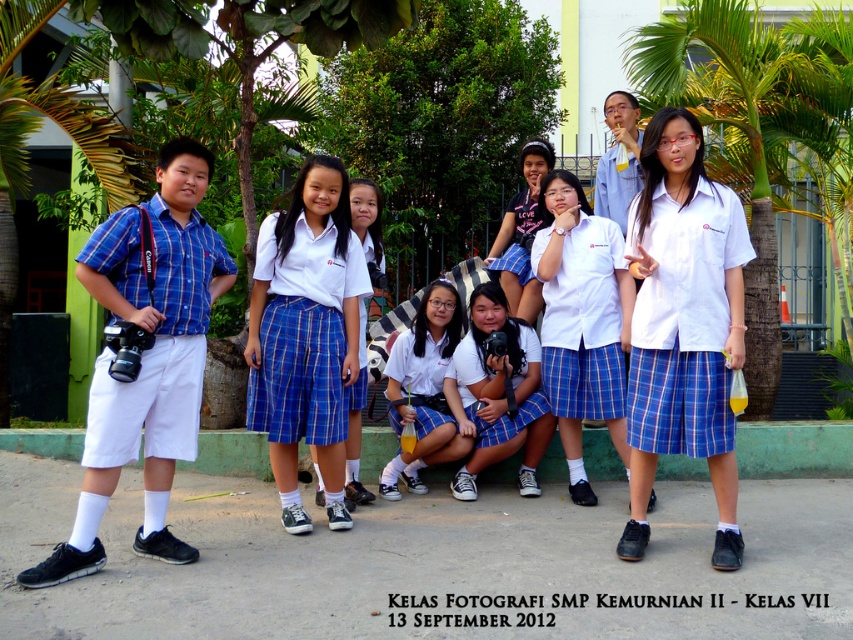
Question: Which object is the closest to the white matte uniform at center?

Choices:
 (A) white plaid skirt at center
 (B) matte black shirt at center
 (C) white glossy skirt at center
 (D) blue plaid skirt at center

Answer: (B)

Question: Where is white plaid skirt at center located in relation to white glossy skirt at center in the image?

Choices:
 (A) above
 (B) below

Answer: (A)

Question: Which object is farther from the camera taking this photo?

Choices:
 (A) blue plaid skirt at center
 (B) white matte camera at center

Answer: (B)

Question: Which is farther from the blue plaid skirt at center?

Choices:
 (A) white glossy skirt at center
 (B) blue plaid shirt at left
 (C) white matte uniform at center

Answer: (C)

Question: Is white plaid skirt at center thinner than white glossy skirt at center?

Choices:
 (A) yes
 (B) no

Answer: (B)

Question: Can you confirm if blue plaid shirt at left is bigger than white matte camera at center?

Choices:
 (A) yes
 (B) no

Answer: (A)